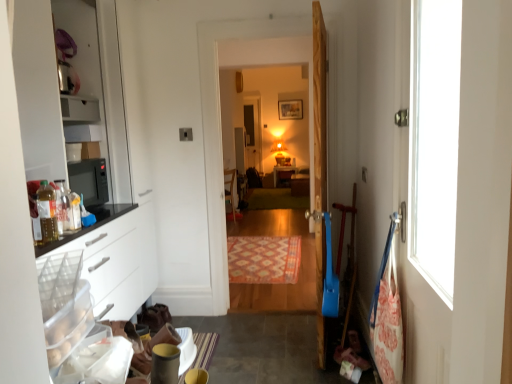
You are a GUI agent. You are given a task and a screenshot of the screen. Output one action in this format:
    pyautogui.click(x=<x>, y=<y>)
    Task: Click on the vacant point above carpeted wooden floor at center (from a real-world perspective)
    Image resolution: width=512 pixels, height=384 pixels.
    Given the screenshot: What is the action you would take?
    pyautogui.click(x=254, y=20)